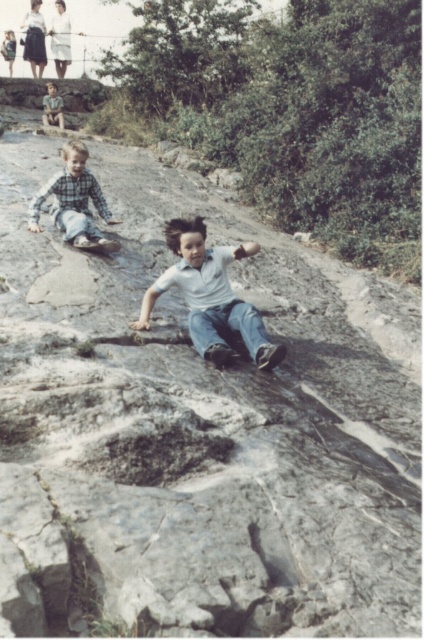
Question: Does white matte shirt at center have a greater width compared to checkered fabric shirt at left?

Choices:
 (A) no
 (B) yes

Answer: (B)

Question: Which point is farther from the camera taking this photo?

Choices:
 (A) (105, 243)
 (B) (220, 308)

Answer: (A)

Question: Is checkered fabric shirt at left further to camera compared to light brown hair at upper left?

Choices:
 (A) yes
 (B) no

Answer: (B)

Question: Which point is farther from the camera taking this photo?

Choices:
 (A) (84, 221)
 (B) (186, 237)

Answer: (A)

Question: Considering the real-world distances, which object is closest to the white matte shirt at center?

Choices:
 (A) checkered fabric shirt at left
 (B) light brown hair at upper left

Answer: (A)

Question: Is white matte shirt at center below checkered fabric shirt at left?

Choices:
 (A) yes
 (B) no

Answer: (A)